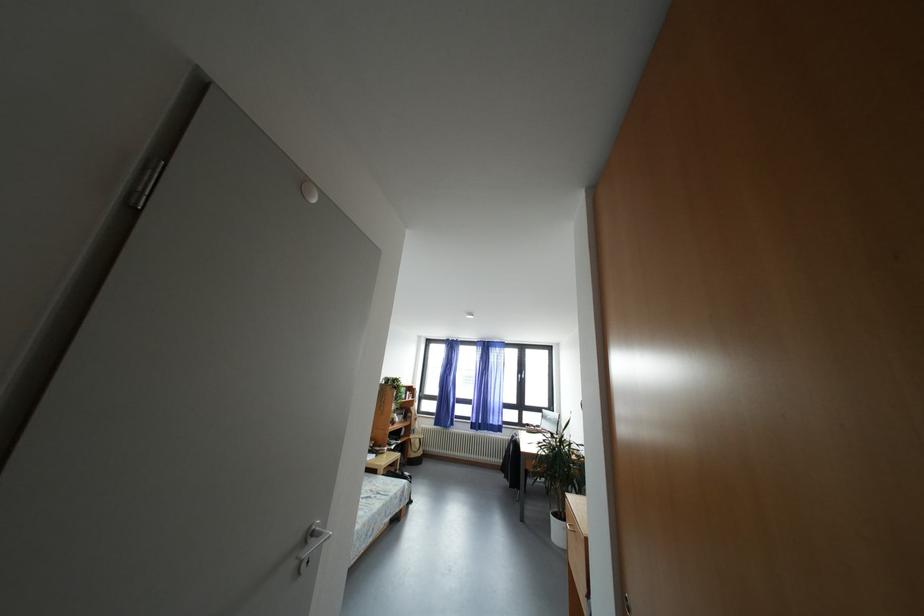
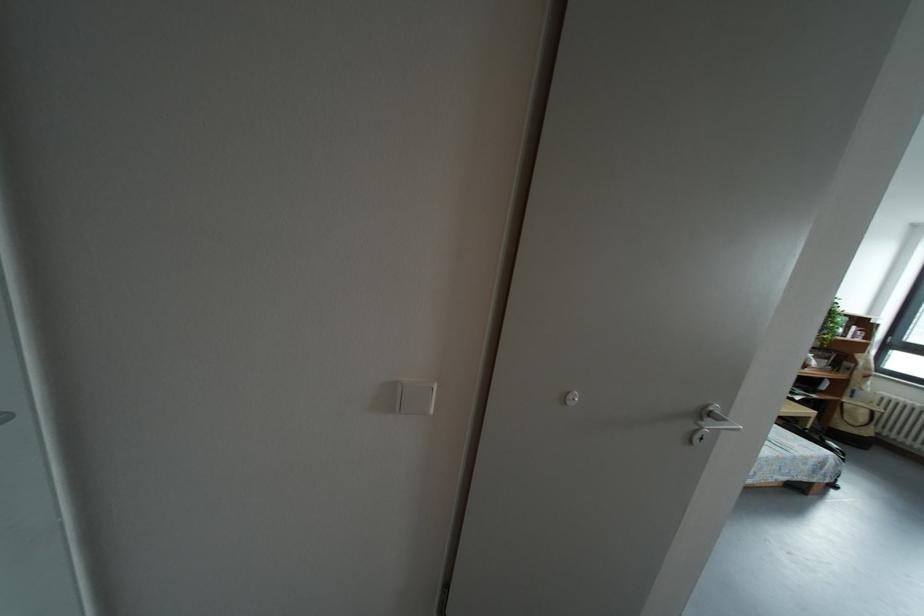
In the second image, find the point that corresponds to (x=320, y=539) in the first image.

(718, 419)